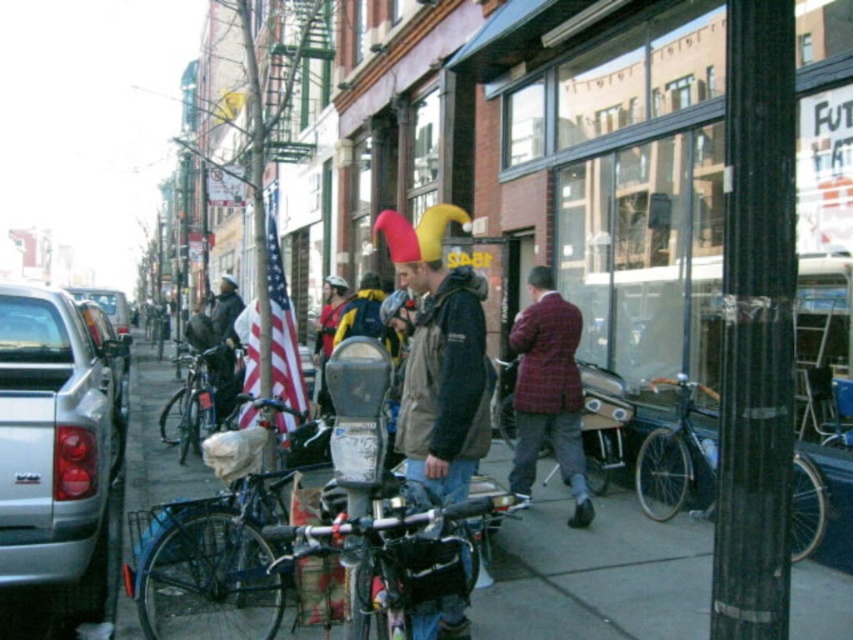
Does plaid wool jacket at center have a lesser height compared to american flag at center?

Indeed, plaid wool jacket at center has a lesser height compared to american flag at center.

Which of these two, plaid wool jacket at center or american flag at center, stands taller?

american flag at center is taller.

In the scene shown: Who is more distant from viewer, (523,406) or (279,337)?

The point (279,337) is more distant.

Locate an element on the screen. The height and width of the screenshot is (640, 853). plaid wool jacket at center is located at coordinates (548, 392).

Is point (746, 545) closer to camera compared to point (44, 304)?

Yes, point (746, 545) is in front of point (44, 304).

Can you confirm if black plastic pole at center is shorter than silver metallic truck at left?

Incorrect, black plastic pole at center's height does not fall short of silver metallic truck at left's.

Locate an element on the screen. black plastic pole at center is located at coordinates (755, 326).

Where is `black plastic pole at center`? The width and height of the screenshot is (853, 640). black plastic pole at center is located at coordinates (755, 326).

Who is shorter, smooth concrete sidewalk at center or shiny black bicycle at center right?

smooth concrete sidewalk at center

Can you confirm if smooth concrete sidewalk at center is positioned to the right of shiny black bicycle at center right?

In fact, smooth concrete sidewalk at center is to the left of shiny black bicycle at center right.

Does point (635, 602) lie behind point (793, 465)?

No, it is in front of (793, 465).

The width and height of the screenshot is (853, 640). I want to click on smooth concrete sidewalk at center, so click(x=596, y=576).